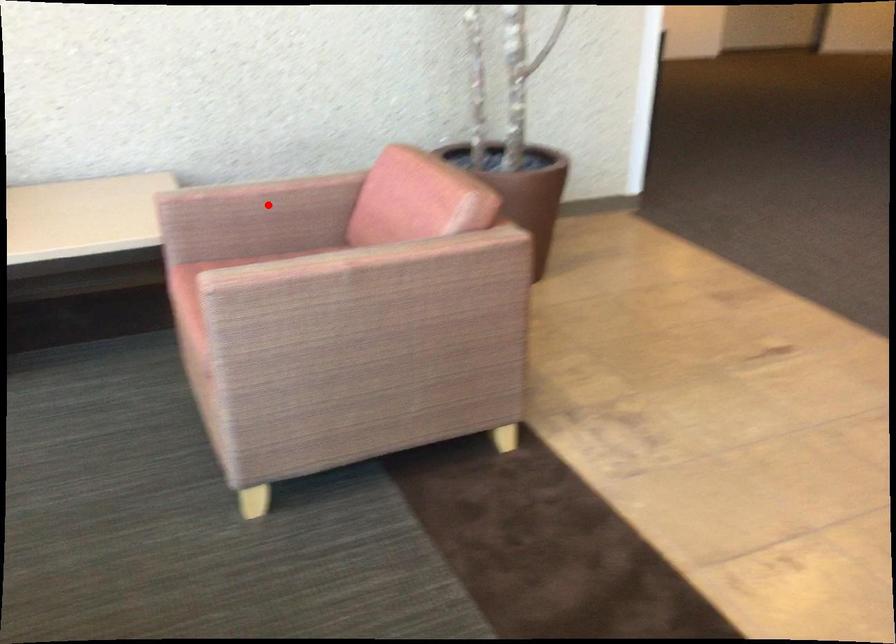
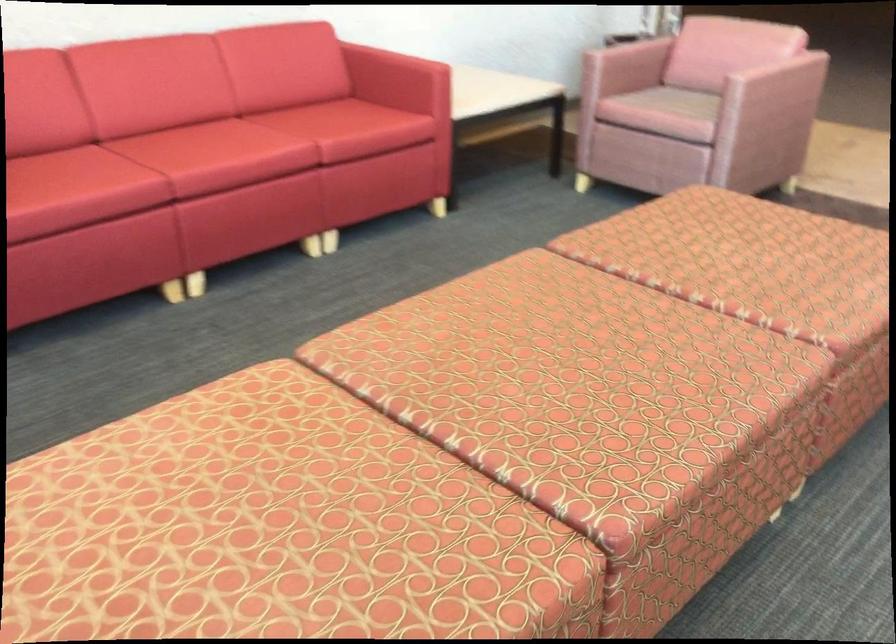
Question: I am providing you with two images of the same scene from different viewpoints. Image1 has a red point marked. In image2, the corresponding 3D location appears at what relative position? Reply with the corresponding letter.

Choices:
 (A) Closer
 (B) Farther

Answer: (B)